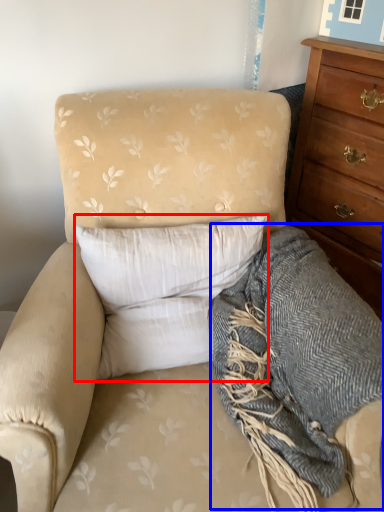
Question: Which of the following is the closest to the observer, pillow (highlighted by a red box) or blanket (highlighted by a blue box)?

Choices:
 (A) pillow
 (B) blanket

Answer: (B)